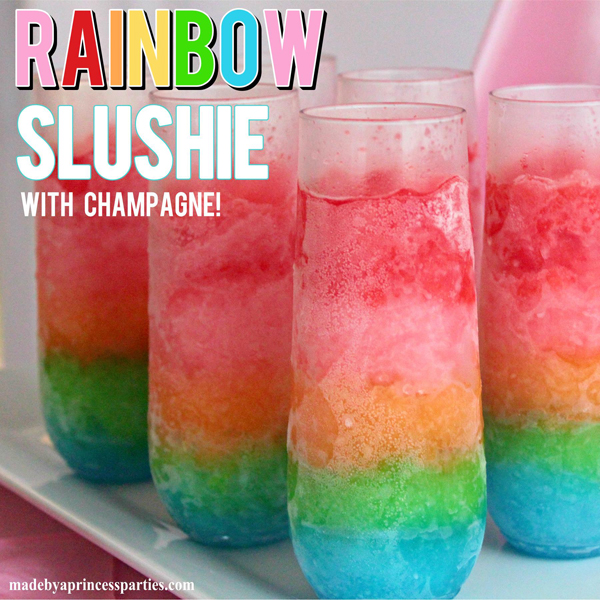
Where is `white square plate`? This screenshot has height=600, width=600. white square plate is located at coordinates (199, 563).